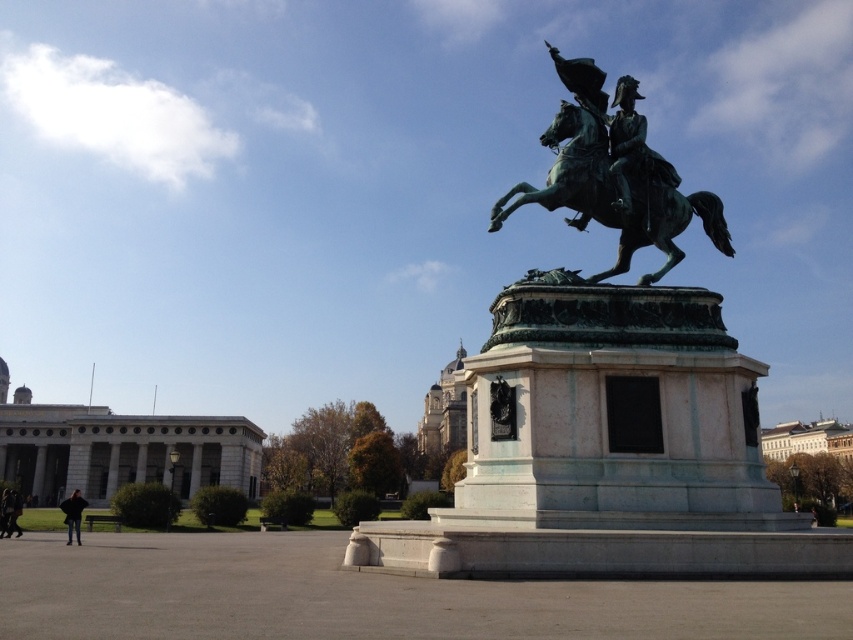
You are standing in the public square and want to take a photo of the statue. The statue is at point [625,138]. If you are at point 0.5, 0.5, which direction should you move to get closer to the statue?

To get closer to the statue located at point [625,138] from your current position at 0.5, 0.5, you should move northwest. This direction will decrease both your x and y coordinates, bringing you closer to the statue.

You are an art student analyzing the statue in the public square. You notice both the green patina statue at center and the green patina horse at center. Which of these two has a taller height?

The green patina statue at center has a greater height compared to the green patina horse at center.